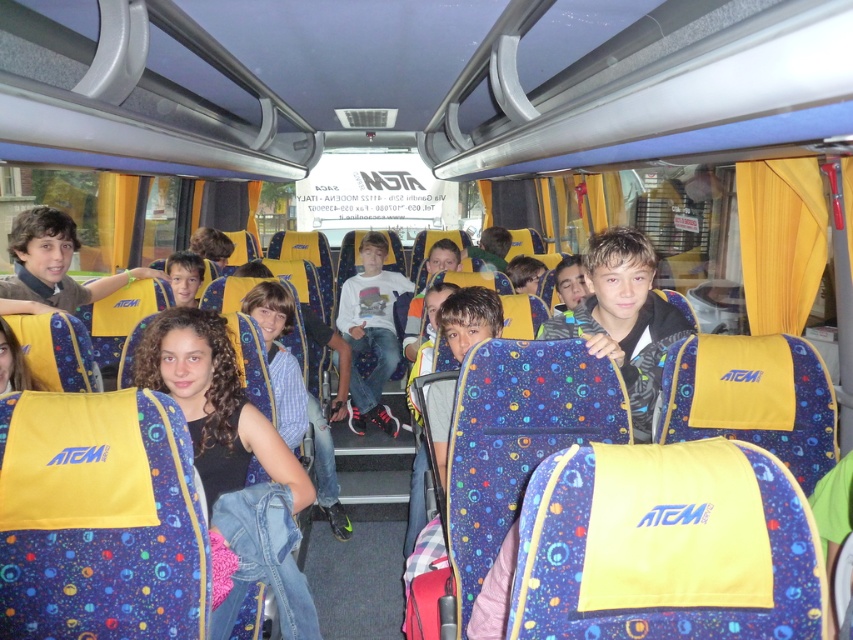
Question: Estimate the real-world distances between objects in this image. Which object is closer to the blue denim jeans at center?

Choices:
 (A) dark brown hair at center
 (B) white cotton shirt at center

Answer: (A)

Question: Which of the following is the closest to the observer?

Choices:
 (A) dark brown hair at center
 (B) white cotton shirt at center

Answer: (A)

Question: Does white cotton shirt at center lie in front of blue denim jeans at center?

Choices:
 (A) yes
 (B) no

Answer: (B)

Question: Does white cotton shirt at center come in front of blue denim jeans at center?

Choices:
 (A) no
 (B) yes

Answer: (A)

Question: Does dark brown hair at center appear on the left side of white cotton shirt at center?

Choices:
 (A) yes
 (B) no

Answer: (A)

Question: Which point is farther from the camera taking this photo?

Choices:
 (A) (183, 384)
 (B) (358, 369)

Answer: (B)